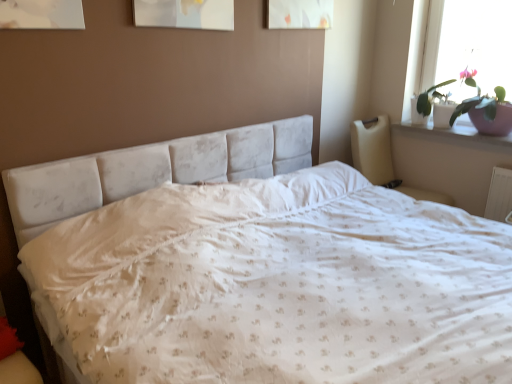
Describe the element at coordinates (373, 150) in the screenshot. The width and height of the screenshot is (512, 384). I see `beige fabric armchair at right` at that location.

In order to face pink ceramic pot at upper right, should I rotate leftwards or rightwards?

To align with it, rotate right about 28.679°.

You are a GUI agent. You are given a task and a screenshot of the screen. Output one action in this format:
    pyautogui.click(x=<x>, y=<y>)
    Task: Click on the white velvety bed at center
    
    Given the screenshot: What is the action you would take?
    pyautogui.click(x=257, y=269)

Locate an element on the screen. This screenshot has height=384, width=512. white glossy window sill at upper right is located at coordinates (455, 132).

From the image's perspective, is white glossy window sill at upper right positioned above or below white velvety bed at center?

→ white glossy window sill at upper right is situated higher than white velvety bed at center in the image.

Is white glossy window sill at upper right turned away from white velvety bed at center?

No, white glossy window sill at upper right is not facing away from white velvety bed at center.

Between white glossy window sill at upper right and white velvety bed at center, which one has smaller size?

white glossy window sill at upper right is smaller.

I want to click on bed on the left of white glossy window sill at upper right, so click(257, 269).

What's the angular difference between pink ceramic pot at upper right and white velvety bed at center's facing directions?

88.8 degrees.

Which is nearer, (510,129) or (170,230)?

The point (170,230) is closer.

Considering the sizes of pink ceramic pot at upper right and white velvety bed at center in the image, is pink ceramic pot at upper right taller or shorter than white velvety bed at center?

Clearly, pink ceramic pot at upper right is shorter compared to white velvety bed at center.

From the picture: Is pink ceramic pot at upper right to the left of white velvety bed at center from the viewer's perspective?

No.

Relative to white glossy window sill at upper right, is white velvety bed at center in front or behind?

Visually, white velvety bed at center is located in front of white glossy window sill at upper right.

What's the angular difference between white velvety bed at center and white glossy window sill at upper right's facing directions?

The angular difference between white velvety bed at center and white glossy window sill at upper right is 89.9 degrees.

Which is nearer, (38, 223) or (502, 140)?

Point (38, 223) is closer to the camera than point (502, 140).

Which object is thinner, white velvety bed at center or white glossy window sill at upper right?

Thinner between the two is white glossy window sill at upper right.

From the image's perspective, is white velvety bed at center beneath beige fabric armchair at right?

Yes, from the image's perspective, white velvety bed at center is below beige fabric armchair at right.

At what (x,y) coordinates should I click in order to perform the action: click on armchair that is on the right side of white velvety bed at center. Please return your answer as a coordinate pair (x, y). The width and height of the screenshot is (512, 384). Looking at the image, I should click on (373, 150).

Based on the photo, which of these two, white velvety bed at center or beige fabric armchair at right, is smaller?

With smaller size is beige fabric armchair at right.

From a real-world perspective, is pink ceramic pot at upper right located beneath beige fabric armchair at right?

No, from a real-world perspective, pink ceramic pot at upper right is not under beige fabric armchair at right.

Which object is further away from the camera taking this photo, pink ceramic pot at upper right or beige fabric armchair at right?

beige fabric armchair at right is further from the camera.

Is pink ceramic pot at upper right situated inside beige fabric armchair at right or outside?

pink ceramic pot at upper right is spatially situated outside beige fabric armchair at right.

Considering the sizes of objects pink ceramic pot at upper right and beige fabric armchair at right in the image provided, who is taller, pink ceramic pot at upper right or beige fabric armchair at right?

beige fabric armchair at right is taller.

In the image, is beige fabric armchair at right on the left side or the right side of white velvety bed at center?

beige fabric armchair at right is to the right of white velvety bed at center.

Is beige fabric armchair at right inside or outside of white velvety bed at center?

beige fabric armchair at right is spatially situated outside white velvety bed at center.

From a real-world perspective, which object stands above the other?

beige fabric armchair at right.

Which of these two, beige fabric armchair at right or white velvety bed at center, is bigger?

white velvety bed at center.

Locate an element on the screen. This screenshot has width=512, height=384. window sill lying behind the beige fabric armchair at right is located at coordinates (455, 132).

Would you consider white glossy window sill at upper right to be distant from beige fabric armchair at right?

No, there isn't a large distance between white glossy window sill at upper right and beige fabric armchair at right.

From the image's perspective, is white glossy window sill at upper right over beige fabric armchair at right?

Yes, from the image's perspective, white glossy window sill at upper right is over beige fabric armchair at right.

Considering the sizes of objects white glossy window sill at upper right and beige fabric armchair at right in the image provided, who is taller, white glossy window sill at upper right or beige fabric armchair at right?

beige fabric armchair at right.

This screenshot has height=384, width=512. In the image, there is a white glossy window sill at upper right. Identify the location of bed below it (from a real-world perspective). (257, 269).

This screenshot has height=384, width=512. I want to click on houseplant on the right of white velvety bed at center, so click(484, 107).

Based on their spatial positions, is beige fabric armchair at right or white glossy window sill at upper right closer to white velvety bed at center?

beige fabric armchair at right is closer to white velvety bed at center.

Looking at the image, which one is located closer to pink ceramic pot at upper right, white velvety bed at center or white glossy window sill at upper right?

white glossy window sill at upper right is positioned closer to the anchor pink ceramic pot at upper right.

When comparing their distances from beige fabric armchair at right, does white glossy window sill at upper right or pink ceramic pot at upper right seem closer?

white glossy window sill at upper right.

When comparing their distances from white velvety bed at center, does pink ceramic pot at upper right or beige fabric armchair at right seem further?

Among the two, pink ceramic pot at upper right is located further to white velvety bed at center.

Which object lies nearer to the anchor point white velvety bed at center, pink ceramic pot at upper right or white glossy window sill at upper right?

pink ceramic pot at upper right lies closer to white velvety bed at center than the other object.

Estimate the real-world distances between objects in this image. Which object is further from white glossy window sill at upper right, white velvety bed at center or pink ceramic pot at upper right?

white velvety bed at center is further to white glossy window sill at upper right.

When comparing their distances from pink ceramic pot at upper right, does beige fabric armchair at right or white glossy window sill at upper right seem closer?

Based on the image, white glossy window sill at upper right appears to be nearer to pink ceramic pot at upper right.

When comparing their distances from white velvety bed at center, does beige fabric armchair at right or pink ceramic pot at upper right seem further?

pink ceramic pot at upper right is further to white velvety bed at center.

At what (x,y) coordinates should I click in order to perform the action: click on houseplant between white velvety bed at center and beige fabric armchair at right along the z-axis. Please return your answer as a coordinate pair (x, y). The height and width of the screenshot is (384, 512). Looking at the image, I should click on (484, 107).

This screenshot has height=384, width=512. I want to click on window sill situated between beige fabric armchair at right and pink ceramic pot at upper right from left to right, so click(x=455, y=132).

Image resolution: width=512 pixels, height=384 pixels. I want to click on armchair between white velvety bed at center and white glossy window sill at upper right along the z-axis, so click(x=373, y=150).

You are a GUI agent. You are given a task and a screenshot of the screen. Output one action in this format:
    pyautogui.click(x=<x>, y=<y>)
    Task: Click on the houseplant positioned between white velvety bed at center and white glossy window sill at upper right from near to far
    The height and width of the screenshot is (384, 512).
    Given the screenshot: What is the action you would take?
    (484, 107)